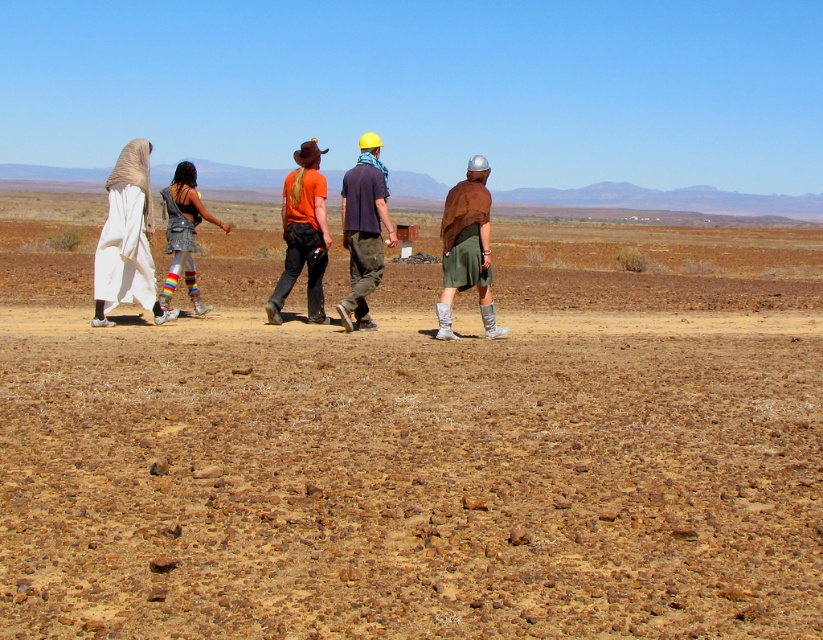
Who is more distant from viewer, (445, 259) or (186, 172)?

Point (186, 172)

Who is lower down, brown fabric cape at center or metallic silver dress at center?

brown fabric cape at center is below.

This screenshot has width=823, height=640. What do you see at coordinates (467, 248) in the screenshot?
I see `brown fabric cape at center` at bounding box center [467, 248].

This screenshot has width=823, height=640. I want to click on brown fabric cape at center, so click(x=467, y=248).

Is white fabric headscarf at left to the right of orange t-shirt at center from the viewer's perspective?

In fact, white fabric headscarf at left is to the left of orange t-shirt at center.

From the picture: Who is higher up, white fabric headscarf at left or orange t-shirt at center?

orange t-shirt at center is higher up.

What do you see at coordinates (128, 240) in the screenshot? I see `white fabric headscarf at left` at bounding box center [128, 240].

Locate an element on the screen. The width and height of the screenshot is (823, 640). white fabric headscarf at left is located at coordinates (128, 240).

Between point (482, 273) and point (374, 202), which one is positioned behind?

Positioned behind is point (374, 202).

Can you confirm if brown fabric cape at center is thinner than dark purple shirt at center?

Correct, brown fabric cape at center's width is less than dark purple shirt at center's.

This screenshot has height=640, width=823. What are the coordinates of `brown fabric cape at center` in the screenshot? It's located at (467, 248).